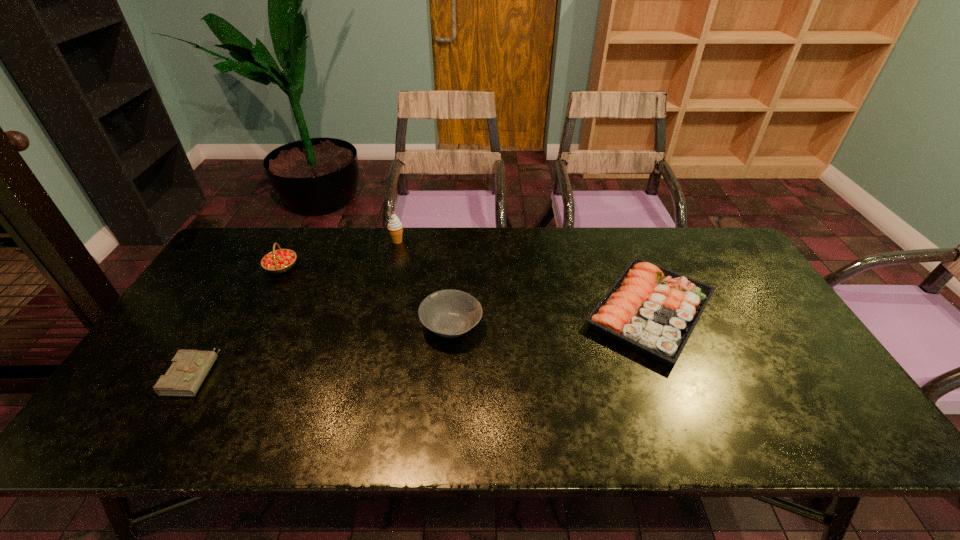
Identify the location of icecream. (395, 226).

I want to click on the farthest object, so click(395, 226).

Locate an element on the screen. The image size is (960, 540). strawberry is located at coordinates (278, 261).

This screenshot has height=540, width=960. What are the coordinates of `the fourth object from left to right` in the screenshot? It's located at (449, 313).

Identify the location of the third shortest object. Image resolution: width=960 pixels, height=540 pixels. (449, 313).

Find the location of a particular element. the fourth tallest object is located at coordinates (651, 309).

Where is `the rightmost object`? The width and height of the screenshot is (960, 540). the rightmost object is located at coordinates (651, 309).

You are a GUI agent. You are given a task and a screenshot of the screen. Output one action in this format:
    pyautogui.click(x=<x>, y=<y>)
    Task: Click on the diary
    The width and height of the screenshot is (960, 540).
    Given the screenshot: What is the action you would take?
    pyautogui.click(x=189, y=368)

The image size is (960, 540). I want to click on free space located 0.140m on the front of the third object from left to right, so click(x=390, y=272).

You are a GUI agent. You are given a task and a screenshot of the screen. Output one action in this format:
    pyautogui.click(x=<x>, y=<y>)
    Task: Click on the free region located on the front of the fourth shortest object
    Image resolution: width=960 pixels, height=540 pixels.
    Given the screenshot: What is the action you would take?
    pyautogui.click(x=256, y=315)